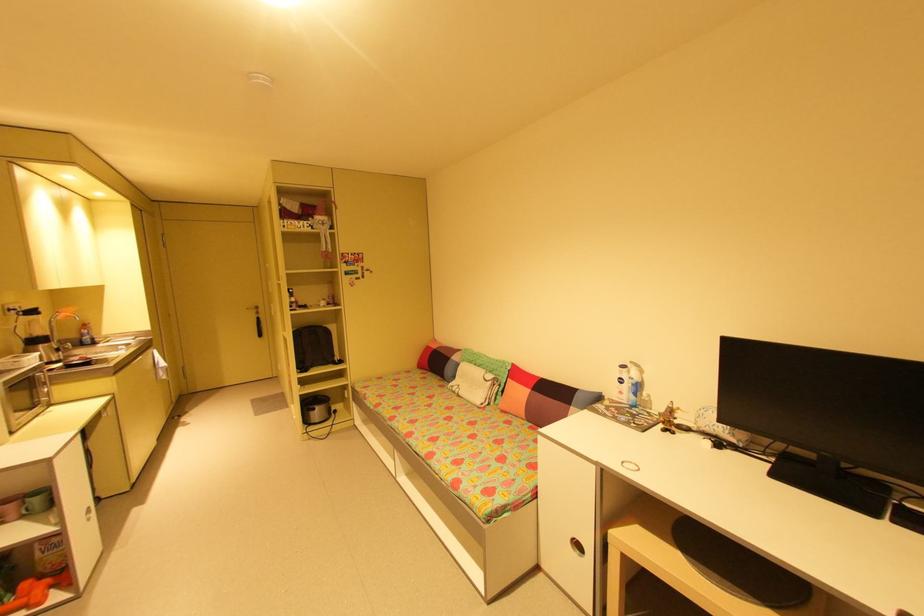
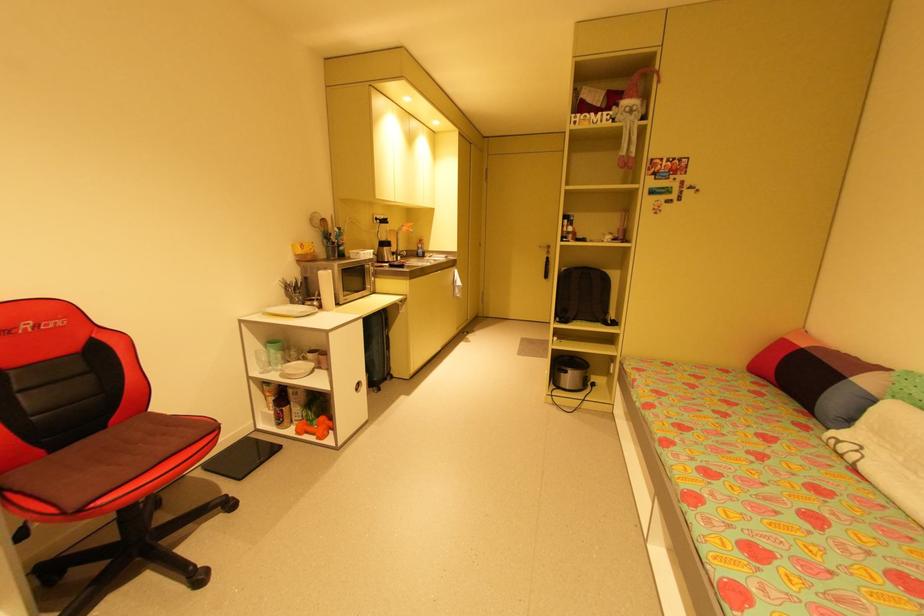
Question: The camera is either moving clockwise (left) or counter-clockwise (right) around the object. The first image is from the beginning of the video and the second image is from the end. Is the camera moving left or right when shooting the video?

Choices:
 (A) Left
 (B) Right

Answer: (B)